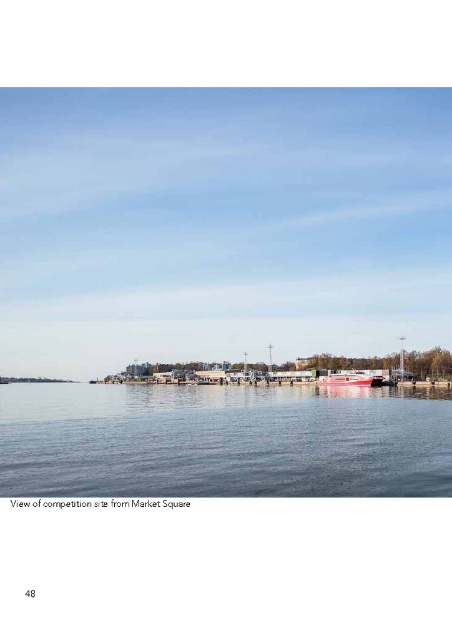
Question: Is transparent blue water at center to the left of red glossy boat at center from the viewer's perspective?

Choices:
 (A) yes
 (B) no

Answer: (A)

Question: Which point is closer to the camera?

Choices:
 (A) (168, 477)
 (B) (376, 380)

Answer: (A)

Question: Which of the following is the closest to the observer?

Choices:
 (A) red glossy boat at center
 (B) transparent blue water at center

Answer: (B)

Question: Among these objects, which one is nearest to the camera?

Choices:
 (A) red glossy boat at center
 (B) transparent blue water at center

Answer: (B)

Question: Does transparent blue water at center appear on the left side of red glossy boat at center?

Choices:
 (A) yes
 (B) no

Answer: (A)

Question: Can you confirm if transparent blue water at center is positioned above red glossy boat at center?

Choices:
 (A) yes
 (B) no

Answer: (B)